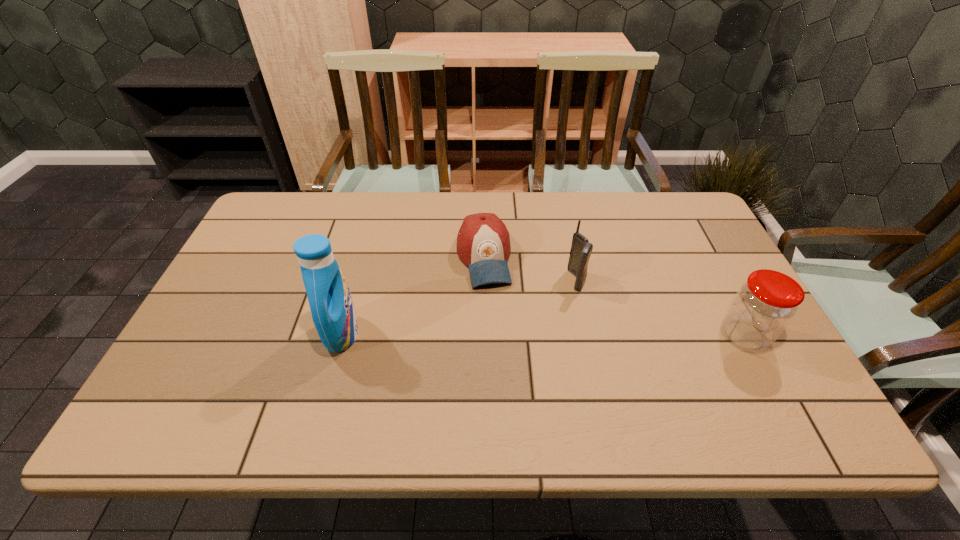
This screenshot has width=960, height=540. In order to click on vacant space located 0.200m on the front-facing side of the baseball cap in this screenshot , I will do [502, 350].

In order to click on vacant space situated 0.190m on the keyboard of the second object from right to left in this screenshot , I will do `click(517, 319)`.

This screenshot has height=540, width=960. Identify the location of free space located on the keyboard of the second object from right to left. (455, 355).

Where is `free space located 0.150m on the keyboard of the second object from right to left`? The height and width of the screenshot is (540, 960). free space located 0.150m on the keyboard of the second object from right to left is located at coordinates (530, 312).

I want to click on object at the far edge, so click(483, 243).

Find the location of a particular element. The height and width of the screenshot is (540, 960). object present at the right edge is located at coordinates point(764,305).

In the image, there is a desktop. At what (x,y) coordinates should I click in order to perform the action: click on free space at the far edge. Please return your answer as a coordinate pair (x, y). The image size is (960, 540). Looking at the image, I should click on pos(385,194).

Where is `free space at the near edge of the desktop`? This screenshot has width=960, height=540. free space at the near edge of the desktop is located at coordinates (568, 383).

Locate an element on the screen. The height and width of the screenshot is (540, 960). free location at the left edge of the desktop is located at coordinates (258, 240).

Find the location of a particular element. Image resolution: width=960 pixels, height=540 pixels. free region at the right edge is located at coordinates (670, 242).